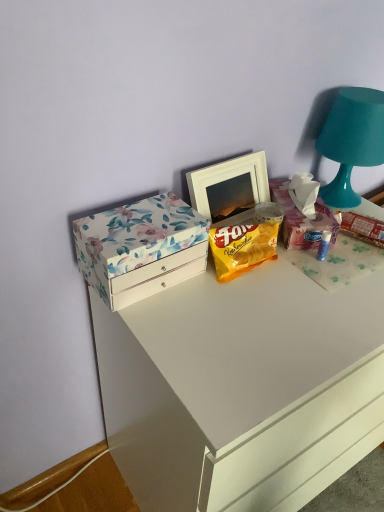
Question: Does teal matte table lamp at upper right come behind floral cardboard box at upper right?

Choices:
 (A) no
 (B) yes

Answer: (B)

Question: Does teal matte table lamp at upper right touch floral cardboard box at upper right?

Choices:
 (A) yes
 (B) no

Answer: (B)

Question: Can you confirm if teal matte table lamp at upper right is taller than floral cardboard box at upper right?

Choices:
 (A) yes
 (B) no

Answer: (A)

Question: From a real-world perspective, is teal matte table lamp at upper right over floral cardboard box at upper right?

Choices:
 (A) yes
 (B) no

Answer: (A)

Question: Can you confirm if teal matte table lamp at upper right is positioned to the right of floral cardboard box at upper right?

Choices:
 (A) no
 (B) yes

Answer: (B)

Question: Is point (380, 143) positioned closer to the camera than point (231, 212)?

Choices:
 (A) closer
 (B) farther

Answer: (A)

Question: From the image's perspective, is teal matte table lamp at upper right above or below white matte picture frame at center?

Choices:
 (A) below
 (B) above

Answer: (B)

Question: Is teal matte table lamp at upper right situated inside white matte picture frame at center or outside?

Choices:
 (A) inside
 (B) outside

Answer: (B)

Question: Based on their positions, is teal matte table lamp at upper right located to the left or right of white matte picture frame at center?

Choices:
 (A) right
 (B) left

Answer: (A)

Question: From the image's perspective, is white matte picture frame at center located above or below floral cardboard box at upper right?

Choices:
 (A) above
 (B) below

Answer: (A)

Question: Is white matte picture frame at center wider or thinner than floral cardboard box at upper right?

Choices:
 (A) thin
 (B) wide

Answer: (A)

Question: Is white matte picture frame at center taller or shorter than floral cardboard box at upper right?

Choices:
 (A) short
 (B) tall

Answer: (B)

Question: In the image, is white matte picture frame at center positioned in front of or behind floral cardboard box at upper right?

Choices:
 (A) front
 (B) behind

Answer: (A)

Question: Considering the positions of teal matte table lamp at upper right and white glossy chest of drawers at upper center in the image, is teal matte table lamp at upper right bigger or smaller than white glossy chest of drawers at upper center?

Choices:
 (A) big
 (B) small

Answer: (B)

Question: In terms of width, does teal matte table lamp at upper right look wider or thinner when compared to white glossy chest of drawers at upper center?

Choices:
 (A) thin
 (B) wide

Answer: (A)